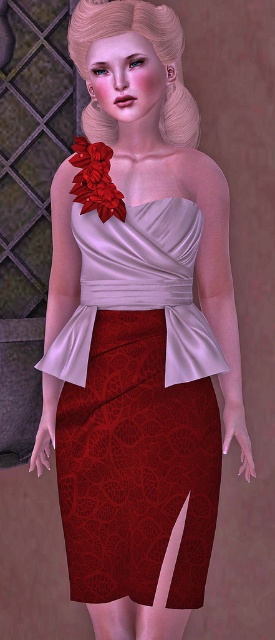
You are a photographer standing 1.5 meters away from the camera. You want to take a photo of the velvet red skirt at center. Can you reach the camera to adjust it?

The velvet red skirt at center and camera are 1.67 meters apart. Since you are already 1.5 meters away from the camera, you would need to move 0.17 meters closer to reach the camera and adjust it.

You are a fashion designer examining a dress design. The dress has a velvet red skirt at center and a shiny red fabric flower at upper center. Based on the dress structure, which part is located higher on the dress?

The shiny red fabric flower at upper center is positioned higher on the dress than the velvet red skirt at center.

You are taking a photo of the dress and want to focus on both the point at point [99,326] and the point at point [100,189]. Which point is closer to the camera?

Point [100,189] is closer to the camera than point [99,326] because the description states that point [99,326] is further away.